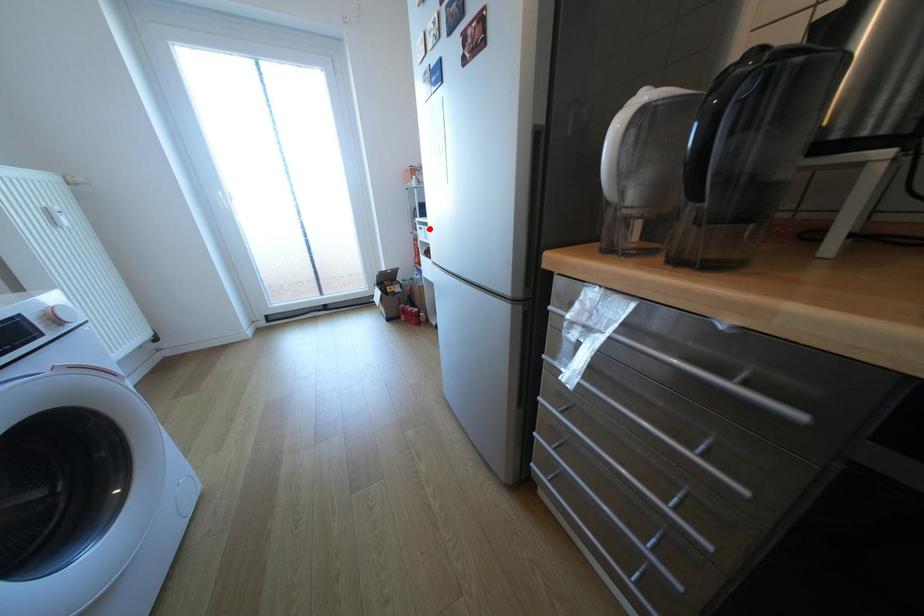
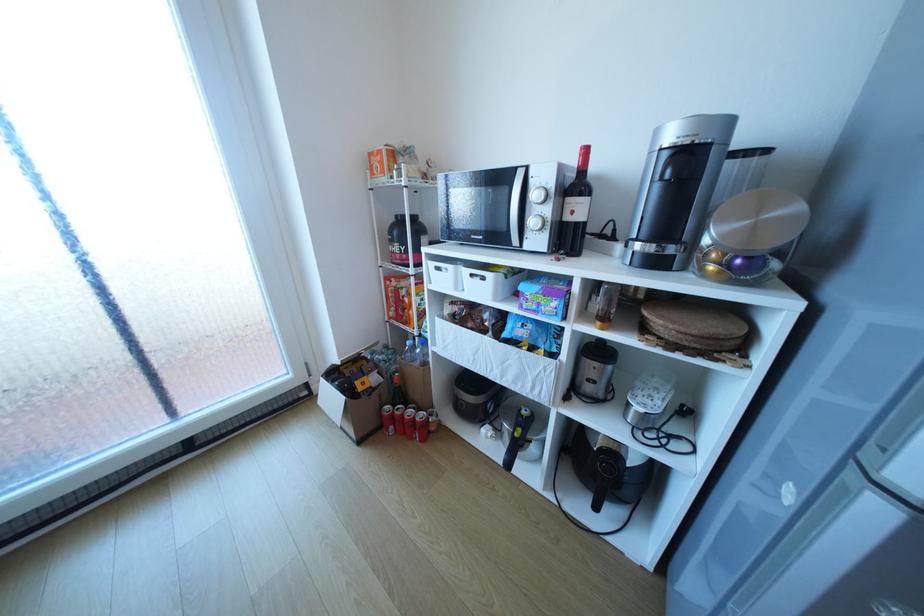
Question: A red point is marked in image1. In image2, is the corresponding 3D point closer to the camera or farther? Reply with the corresponding letter.

Choices:
 (A) The corresponding 3D point is closer.
 (B) The corresponding 3D point is farther.

Answer: (B)